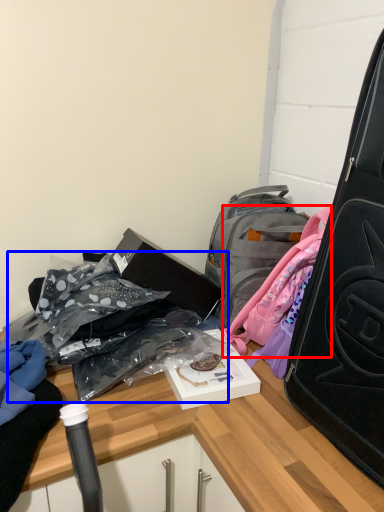
Question: Which point is closer to the camera, backpack (highlighted by a red box) or bag (highlighted by a blue box)?

Choices:
 (A) backpack
 (B) bag

Answer: (B)